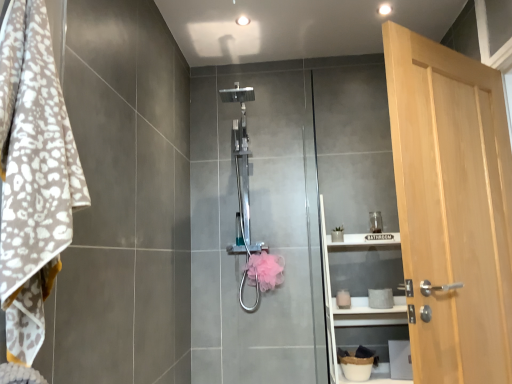
Question: From the image's perspective, is polished chrome shower at center below pink fluffy hand towel at center?

Choices:
 (A) yes
 (B) no

Answer: (B)

Question: Considering the relative positions of polished chrome shower at center and pink fluffy hand towel at center in the image provided, is polished chrome shower at center to the right of pink fluffy hand towel at center from the viewer's perspective?

Choices:
 (A) yes
 (B) no

Answer: (B)

Question: Is polished chrome shower at center not near pink fluffy hand towel at center?

Choices:
 (A) yes
 (B) no

Answer: (B)

Question: Does polished chrome shower at center have a lesser height compared to pink fluffy hand towel at center?

Choices:
 (A) yes
 (B) no

Answer: (B)

Question: From a real-world perspective, is polished chrome shower at center located beneath pink fluffy hand towel at center?

Choices:
 (A) yes
 (B) no

Answer: (B)

Question: From a real-world perspective, is light brown wood door at right positioned above or below pink fluffy hand towel at center?

Choices:
 (A) below
 (B) above

Answer: (B)

Question: Relative to pink fluffy hand towel at center, is light brown wood door at right in front or behind?

Choices:
 (A) front
 (B) behind

Answer: (A)

Question: Is light brown wood door at right inside the boundaries of pink fluffy hand towel at center, or outside?

Choices:
 (A) outside
 (B) inside

Answer: (A)

Question: Does point (403, 228) appear closer or farther from the camera than point (262, 256)?

Choices:
 (A) farther
 (B) closer

Answer: (B)

Question: Considering their positions, is white leopard print towel at left located in front of or behind white matte shelf at center?

Choices:
 (A) behind
 (B) front

Answer: (B)

Question: Considering the positions of white leopard print towel at left and white matte shelf at center in the image, is white leopard print towel at left taller or shorter than white matte shelf at center?

Choices:
 (A) short
 (B) tall

Answer: (A)

Question: From the image's perspective, is white leopard print towel at left above or below white matte shelf at center?

Choices:
 (A) above
 (B) below

Answer: (A)

Question: From a real-world perspective, relative to white matte shelf at center, is white leopard print towel at left vertically above or below?

Choices:
 (A) above
 (B) below

Answer: (A)

Question: From a real-world perspective, is white leopard print towel at left physically located above or below light brown wood door at right?

Choices:
 (A) above
 (B) below

Answer: (A)

Question: Considering the positions of white leopard print towel at left and light brown wood door at right in the image, is white leopard print towel at left taller or shorter than light brown wood door at right?

Choices:
 (A) short
 (B) tall

Answer: (A)